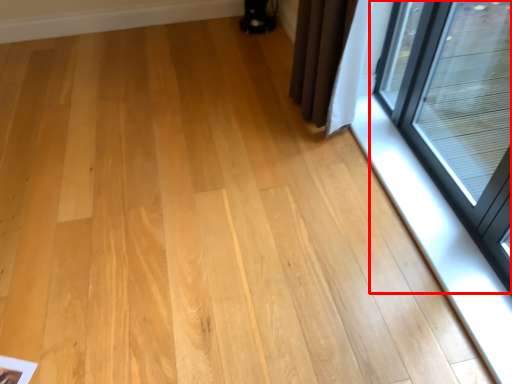
Question: In this image, where is window (annotated by the red box) located relative to window sill?

Choices:
 (A) right
 (B) left

Answer: (A)